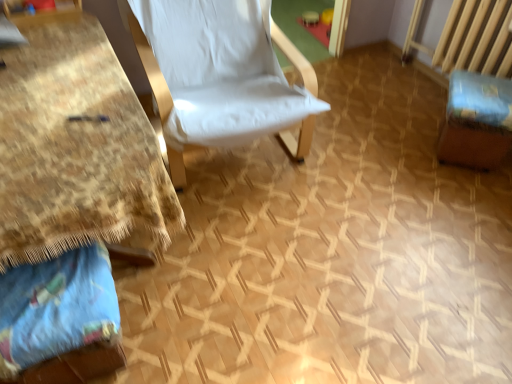
Locate an element on the screen. The height and width of the screenshot is (384, 512). free space to the left of brown fabric swivel chair at right is located at coordinates (402, 153).